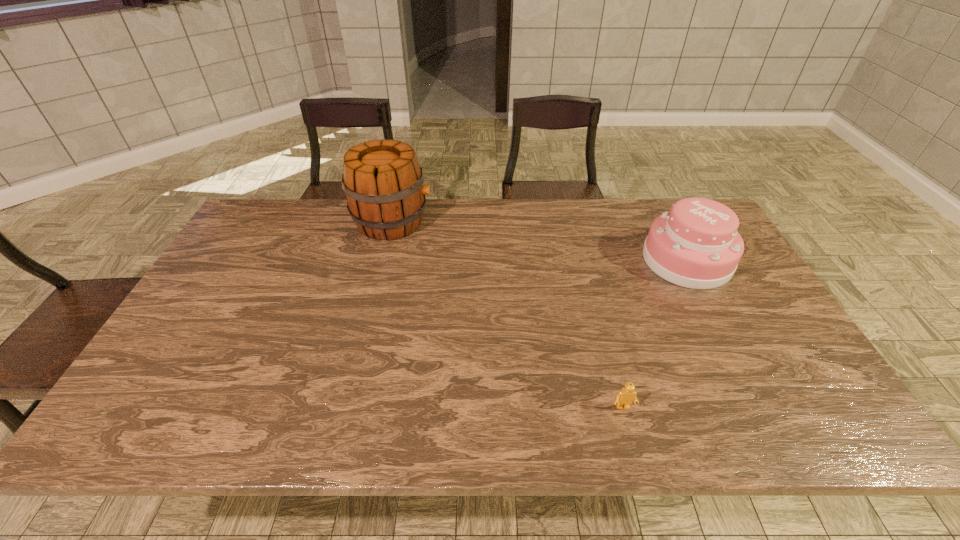
Where is `object that is at the near edge`? The image size is (960, 540). object that is at the near edge is located at coordinates (625, 397).

Find the location of a particular element. The width and height of the screenshot is (960, 540). object that is at the right edge is located at coordinates (696, 245).

This screenshot has height=540, width=960. I want to click on object located at the far right corner, so click(696, 245).

At what (x,y) coordinates should I click in order to perform the action: click on vacant area at the far edge of the desktop. Please return your answer as a coordinate pair (x, y). Looking at the image, I should click on (580, 226).

Identify the location of free space at the near edge. (699, 408).

Where is `vacant area at the left edge of the desktop`? This screenshot has width=960, height=540. vacant area at the left edge of the desktop is located at coordinates (206, 380).

In the image, there is a desktop. What are the coordinates of `vacant area at the right edge` in the screenshot? It's located at (754, 349).

Locate an element on the screen. Image resolution: width=960 pixels, height=540 pixels. vacant space at the far left corner of the desktop is located at coordinates (286, 200).

Where is `free spot between the leftmost object and the Lego`? free spot between the leftmost object and the Lego is located at coordinates (508, 314).

I want to click on vacant space in between the shortest object and the second shortest object, so click(x=655, y=334).